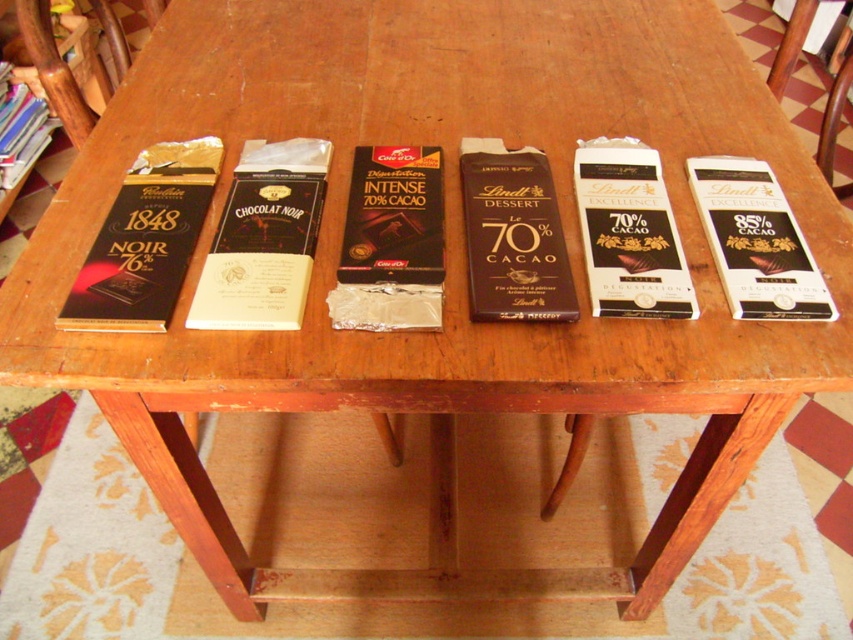
You are a chocolate connoisseur who wants to place a new chocolate bar between the dark brown chocolate bar at center and the matte black lindt excellence chocolate bar at center. The new chocolate bar is 2 inches wide. Is there enough space between them to fit the new chocolate bar?

The distance between the dark brown chocolate bar at center and the matte black lindt excellence chocolate bar at center is 6.04 inches. Since the new chocolate bar is 2 inches wide, there is enough space to fit it between them.

You are organizing a chocolate tasting event and need to arrange the matte white chocolate bar at center and the matte black chocolate bar at left in order from left to right. Which one should come first?

The matte black chocolate bar at left should come first since it is positioned to the left of the matte white chocolate bar at center.